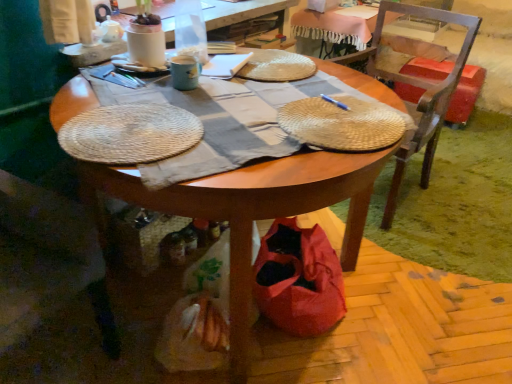
Describe the element at coordinates (335, 102) in the screenshot. The width and height of the screenshot is (512, 384). I see `blue metallic pen at center` at that location.

Where is `woven straw placemat at center`? Image resolution: width=512 pixels, height=384 pixels. woven straw placemat at center is located at coordinates (343, 123).

Locate an element on the screen. This screenshot has height=384, width=512. woven wood chair at lower left, positioned as the 1th chair in left-to-right order is located at coordinates tap(47, 260).

Describe the element at coordinates (184, 72) in the screenshot. I see `matte ceramic mug at upper center` at that location.

This screenshot has height=384, width=512. Identify the location of wooden table at center. (251, 210).

From a real-world perspective, who is located lower, matte ceramic mug at upper center or woven wood chair at lower left, marked as the first chair in a front-to-back arrangement?

From a 3D spatial view, woven wood chair at lower left, marked as the first chair in a front-to-back arrangement, is below.

Considering the points (185, 65) and (57, 267), which point is behind, point (185, 65) or point (57, 267)?

The point (185, 65) is farther from the camera.

Can you confirm if matte ceramic mug at upper center is taller than woven wood chair at lower left, the 2th chair from the back?

No, matte ceramic mug at upper center is not taller than woven wood chair at lower left, the 2th chair from the back.

Does translucent plastic bottle at upper center have a smaller size compared to wooden table at center?

Yes, translucent plastic bottle at upper center is smaller than wooden table at center.

Considering the relative positions of translucent plastic bottle at upper center and wooden table at center in the image provided, is translucent plastic bottle at upper center to the left or to the right of wooden table at center?

From the image, it's evident that translucent plastic bottle at upper center is to the left of wooden table at center.

At what (x,y) coordinates should I click in order to perform the action: click on desk that is under the translucent plastic bottle at upper center (from a real-world perspective). Please return your answer as a coordinate pair (x, y). This screenshot has height=384, width=512. Looking at the image, I should click on point(251,210).

Is woven wood chair at lower left, positioned as the 1th chair in left-to-right order, to the right of wooden chair at right, the second chair viewed from the left, from the viewer's perspective?

No.

Between woven wood chair at lower left, marked as the first chair in a front-to-back arrangement, and wooden chair at right, the 2th chair in the front-to-back sequence, which one has larger size?

wooden chair at right, the 2th chair in the front-to-back sequence.

Which point is more forward, (1, 316) or (425, 177)?

The point (1, 316) is closer.

Is wooden chair at right, placed as the first chair when sorted from back to front, to the left or to the right of matte ceramic mug at upper center in the image?

From the image, it's evident that wooden chair at right, placed as the first chair when sorted from back to front, is to the right of matte ceramic mug at upper center.

Considering the relative positions of wooden chair at right, marked as the first chair in a right-to-left arrangement, and matte ceramic mug at upper center in the image provided, is wooden chair at right, marked as the first chair in a right-to-left arrangement, in front of matte ceramic mug at upper center?

No, wooden chair at right, marked as the first chair in a right-to-left arrangement, is further to the viewer.

From a real-world perspective, which is physically above, wooden chair at right, placed as the first chair when sorted from back to front, or matte ceramic mug at upper center?

matte ceramic mug at upper center.

Between wooden chair at right, the second chair viewed from the left, and matte ceramic mug at upper center, which one has smaller width?

matte ceramic mug at upper center.

From a real-world perspective, does matte ceramic mug at upper center stand above blue metallic pen at center?

Yes, from a real-world perspective, matte ceramic mug at upper center is over blue metallic pen at center

From the image's perspective, which is below, matte ceramic mug at upper center or blue metallic pen at center?

blue metallic pen at center.

Can you tell me how much matte ceramic mug at upper center and blue metallic pen at center differ in facing direction?

The facing directions of matte ceramic mug at upper center and blue metallic pen at center are 44.5 degrees apart.

Is matte ceramic mug at upper center looking in the opposite direction of blue metallic pen at center?

matte ceramic mug at upper center is not turned away from blue metallic pen at center.

Could you tell me if translucent plastic bottle at upper center is facing matte ceramic mug at upper center?

No, translucent plastic bottle at upper center is not facing towards matte ceramic mug at upper center.

How far apart are translucent plastic bottle at upper center and matte ceramic mug at upper center?

translucent plastic bottle at upper center and matte ceramic mug at upper center are 6.45 inches apart.

Considering the points (203, 42) and (186, 62), which point is in front, point (203, 42) or point (186, 62)?

The point (186, 62) is closer to the camera.

Which object is more forward, translucent plastic bottle at upper center or matte ceramic mug at upper center?

matte ceramic mug at upper center is more forward.

From a real-world perspective, count 1st chairs downward from the matte ceramic mug at upper center and point to it. Please provide its 2D coordinates.

[(420, 89)]

Considering the sizes of objects matte ceramic mug at upper center and wooden chair at right, placed as the first chair when sorted from back to front, in the image provided, who is shorter, matte ceramic mug at upper center or wooden chair at right, placed as the first chair when sorted from back to front,?

Standing shorter between the two is matte ceramic mug at upper center.

Between matte ceramic mug at upper center and wooden chair at right, the 2th chair in the front-to-back sequence, which one appears on the left side from the viewer's perspective?

matte ceramic mug at upper center is more to the left.

From a real-world perspective, starting from the matte ceramic mug at upper center, which chair is the 2nd one below it? Please provide its 2D coordinates.

[(47, 260)]

This screenshot has height=384, width=512. Find the location of `desk in front of the translucent plastic bottle at upper center`. desk in front of the translucent plastic bottle at upper center is located at coordinates (251, 210).

Consider the image. Based on their spatial positions, is woven straw placemat at center or red plastic trash can at right closer to wooden table at center?

Based on the image, woven straw placemat at center appears to be nearer to wooden table at center.

Looking at the image, which one is located closer to woven wood chair at lower left, the 2th chair from the back, translucent plastic bottle at upper center or blue metallic pen at center?

Based on the image, translucent plastic bottle at upper center appears to be nearer to woven wood chair at lower left, the 2th chair from the back.

When comparing their distances from woven straw placemat at center, does wooden chair at right, the 2th chair in the front-to-back sequence, or translucent plastic bottle at upper center seem further?

Based on the image, wooden chair at right, the 2th chair in the front-to-back sequence, appears to be further to woven straw placemat at center.

Based on their spatial positions, is blue metallic pen at center or wooden table at center closer to red plastic trash can at right?

blue metallic pen at center is positioned closer to the anchor red plastic trash can at right.

From the image, which object appears to be farther from wooden table at center, red plastic trash can at right or wooden chair at right, placed as the first chair when sorted from back to front?

red plastic trash can at right is positioned further to the anchor wooden table at center.

Looking at the image, which one is located further to translucent plastic bottle at upper center, woven wood chair at lower left, the 2th chair from the back, or red plastic trash can at right?

red plastic trash can at right lies further to translucent plastic bottle at upper center than the other object.

Estimate the real-world distances between objects in this image. Which object is closer to woven wood chair at lower left, the 2th chair from the back, blue metallic pen at center or wooden table at center?

Based on the image, wooden table at center appears to be nearer to woven wood chair at lower left, the 2th chair from the back.

Considering their positions, is woven straw placemat at center positioned closer to blue metallic pen at center than matte ceramic mug at upper center?

woven straw placemat at center is positioned closer to the anchor blue metallic pen at center.

At what (x,y) coordinates should I click in order to perform the action: click on bottle situated between matte ceramic mug at upper center and woven straw placemat at center from left to right. Please return your answer as a coordinate pair (x, y). Image resolution: width=512 pixels, height=384 pixels. Looking at the image, I should click on (x=190, y=30).

Where is `chair situated between woven wood chair at lower left, positioned as the 1th chair in left-to-right order, and red plastic trash can at right from left to right`? Image resolution: width=512 pixels, height=384 pixels. chair situated between woven wood chair at lower left, positioned as the 1th chair in left-to-right order, and red plastic trash can at right from left to right is located at coordinates (420, 89).

The height and width of the screenshot is (384, 512). What are the coordinates of `chair situated between matte ceramic mug at upper center and red plastic trash can at right from left to right` in the screenshot? It's located at (420, 89).

Where is `coffee cup between translucent plastic bottle at upper center and woven wood chair at lower left, marked as the first chair in a front-to-back arrangement, in the up-down direction`? coffee cup between translucent plastic bottle at upper center and woven wood chair at lower left, marked as the first chair in a front-to-back arrangement, in the up-down direction is located at coordinates (184, 72).